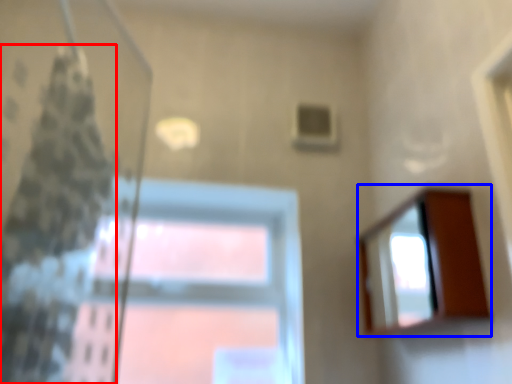
Question: Which object is further to the camera taking this photo, shower curtain (highlighted by a red box) or mirror (highlighted by a blue box)?

Choices:
 (A) shower curtain
 (B) mirror

Answer: (B)